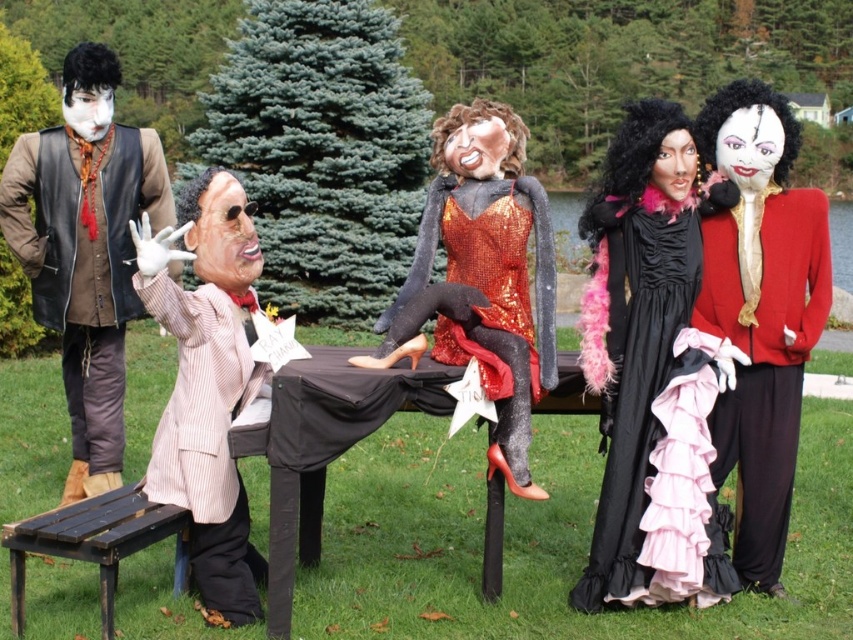
You are a costume designer preparing for a Halloween parade. You need to decide which of the two central scarecrows, the one wearing the black satin dress at center or the one in the velvet red coat at right, will require a wider fabric for their costume. Based on the scene, which one needs more fabric?

The black satin dress at center requires more fabric because its width is larger than the velvet red coat at right.

You are a photographer setting up a shot at the Halloween scarecrow display. You want to ensure the shiny sequined dress at center and the wooden park bench at lower left are both visible in the frame. Which object should you position closer to the camera to make them appear the same size?

To make the shiny sequined dress at center and the wooden park bench at lower left appear the same size in the photo, position the shorter wooden park bench at lower left closer to the camera since the shiny sequined dress at center is taller.